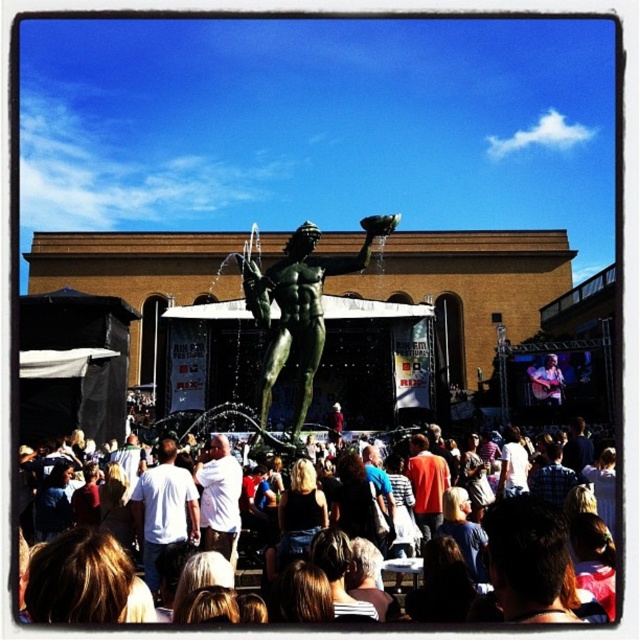
Question: Which point is closer to the camera?

Choices:
 (A) (156, 509)
 (B) (520, 531)
 (C) (212, 465)
 (D) (291, 305)

Answer: (B)

Question: Is multicolored fabric crowd at center bigger than white cotton shirt at center?

Choices:
 (A) no
 (B) yes

Answer: (B)

Question: Based on their relative distances, which object is nearer to the white matte shirt at center?

Choices:
 (A) bronze statue at center
 (B) multicolored fabric crowd at center
 (C) white cotton shirt at center

Answer: (C)

Question: Does white matte shirt at center lie in front of white cotton shirt at center?

Choices:
 (A) yes
 (B) no

Answer: (A)

Question: Does multicolored fabric crowd at center have a lesser width compared to white matte shirt at center?

Choices:
 (A) yes
 (B) no

Answer: (B)

Question: Which point is farther from the camera taking this photo?

Choices:
 (A) (605, 604)
 (B) (172, 481)
 (C) (323, 312)

Answer: (C)